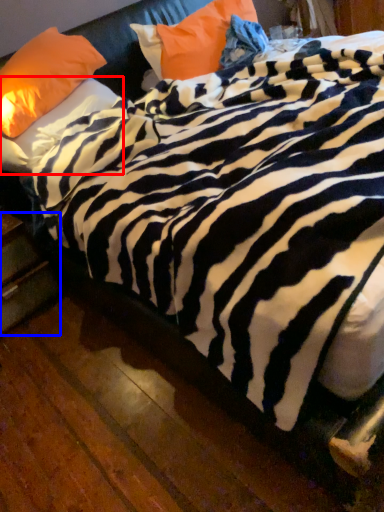
Question: Which point is further to the camera, pillow (highlighted by a red box) or drawer (highlighted by a blue box)?

Choices:
 (A) pillow
 (B) drawer

Answer: (B)